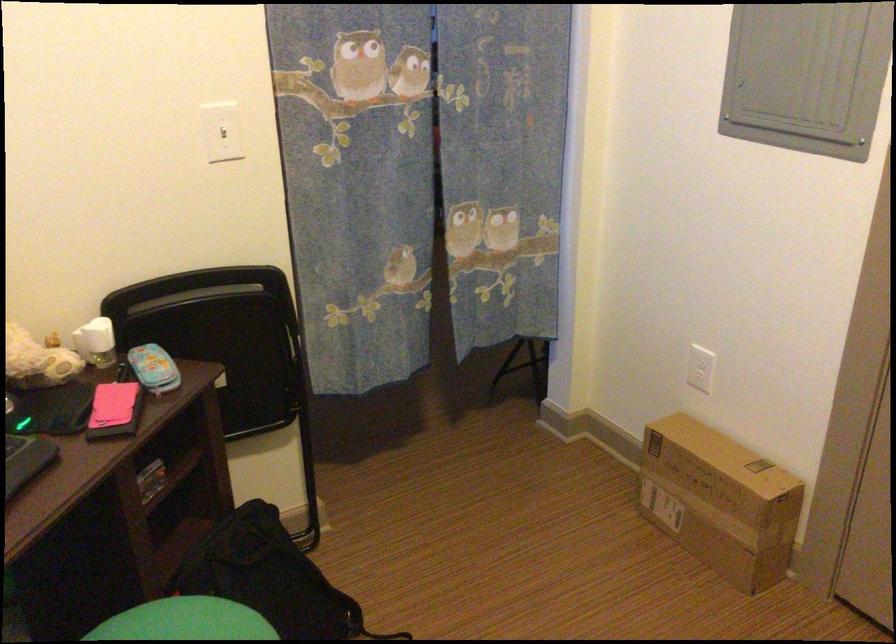
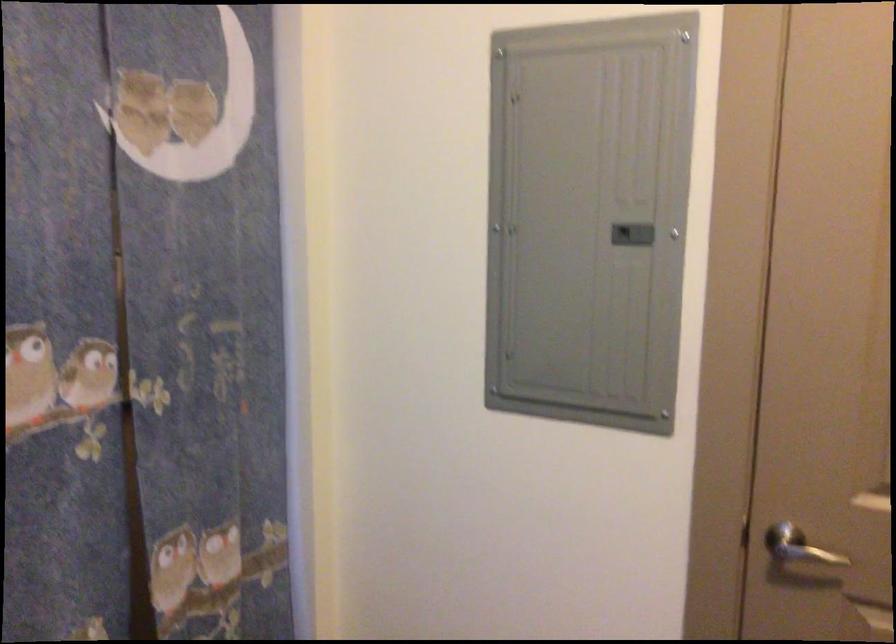
Question: The images are taken continuously from a first-person perspective. In which direction is your viewpoint rotating?

Choices:
 (A) Left
 (B) Right
 (C) Up
 (D) Down

Answer: (B)